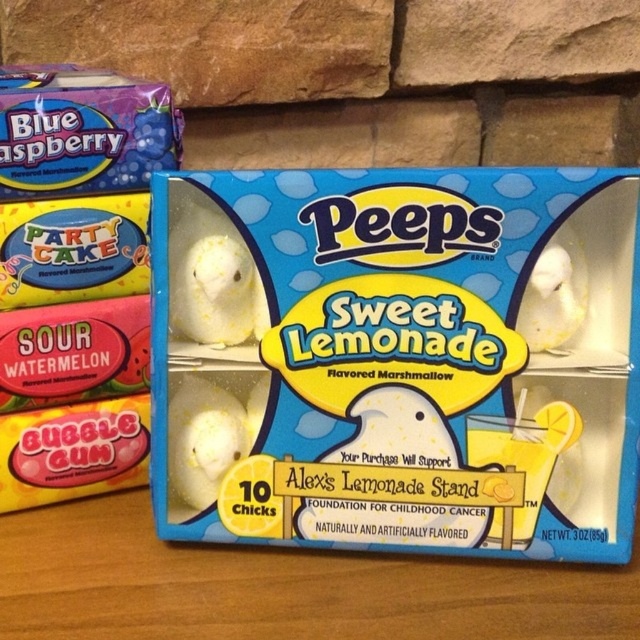
Is matte plastic marshmallows at upper left further to the viewer compared to white matte chick at center?

Yes, it is.

Describe the element at coordinates (76, 280) in the screenshot. I see `matte plastic marshmallows at upper left` at that location.

Locate an element on the screen. This screenshot has width=640, height=640. matte plastic marshmallows at upper left is located at coordinates (76, 280).

Does point (528, 540) lie behind point (147, 212)?

No, it is not.

The height and width of the screenshot is (640, 640). What do you see at coordinates (392, 362) in the screenshot?
I see `white matte marshmallow chicks at center` at bounding box center [392, 362].

Does point (513, 280) lie behind point (106, 374)?

No, it is not.

At what (x,y) coordinates should I click in order to perform the action: click on white matte marshmallow chicks at center. Please return your answer as a coordinate pair (x, y). The width and height of the screenshot is (640, 640). Looking at the image, I should click on (392, 362).

From the picture: Does white matte marshmallow chicks at center have a larger size compared to white matte chick at center?

Indeed, white matte marshmallow chicks at center has a larger size compared to white matte chick at center.

Which of these two, white matte marshmallow chicks at center or white matte chick at center, stands taller?

white matte marshmallow chicks at center

Between point (564, 480) and point (552, 257), which one is positioned behind?

Point (564, 480)

You are a GUI agent. You are given a task and a screenshot of the screen. Output one action in this format:
    pyautogui.click(x=<x>, y=<y>)
    Task: Click on the white matte marshmallow chicks at center
    The image size is (640, 640).
    Given the screenshot: What is the action you would take?
    pyautogui.click(x=392, y=362)